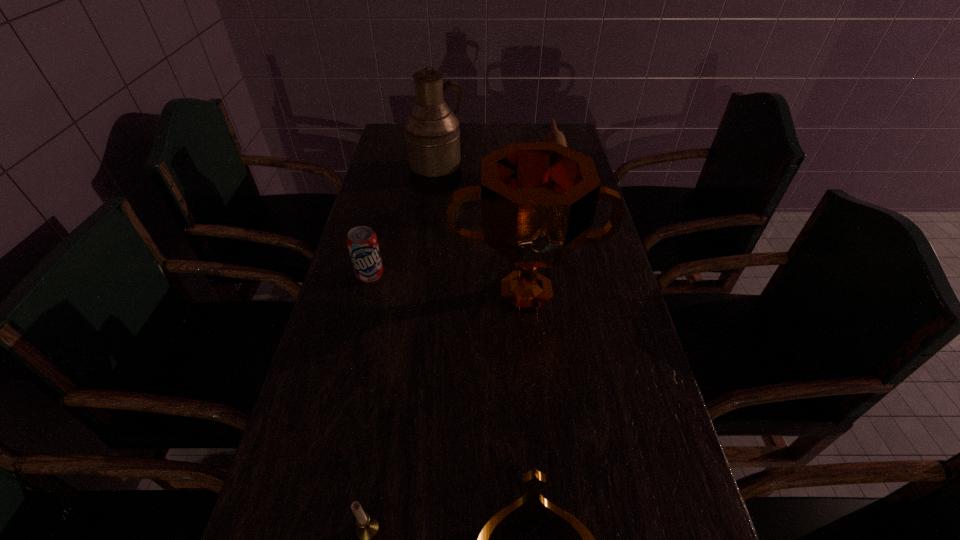
Where is `pitcher located at the left edge`? Image resolution: width=960 pixels, height=540 pixels. pitcher located at the left edge is located at coordinates (432, 134).

Find the location of a particular element. soda can at the left edge is located at coordinates (362, 243).

Find the location of `award at the right edge`. award at the right edge is located at coordinates (538, 199).

In order to click on puppy that is at the right edge in this screenshot , I will do `click(554, 135)`.

Find the location of a particular element. The height and width of the screenshot is (540, 960). vacant space at the far edge is located at coordinates (466, 151).

The image size is (960, 540). Find the location of `vacant space at the left edge of the desktop`. vacant space at the left edge of the desktop is located at coordinates (300, 468).

Where is `vacant position at the right edge of the desktop`? This screenshot has width=960, height=540. vacant position at the right edge of the desktop is located at coordinates (621, 348).

In the image, there is a desktop. Where is `vacant space at the far right corner`? The image size is (960, 540). vacant space at the far right corner is located at coordinates (568, 141).

Identify which object is the third nearest to the pitcher. Please provide its 2D coordinates. Your answer should be formatted as a tuple, i.e. [(x, y)], where the tuple contains the x and y coordinates of a point satisfying the conditions above.

[(362, 243)]

Select which object appears as the fourth closest to the puppy. Please provide its 2D coordinates. Your answer should be formatted as a tuple, i.e. [(x, y)], where the tuple contains the x and y coordinates of a point satisfying the conditions above.

[(531, 507)]